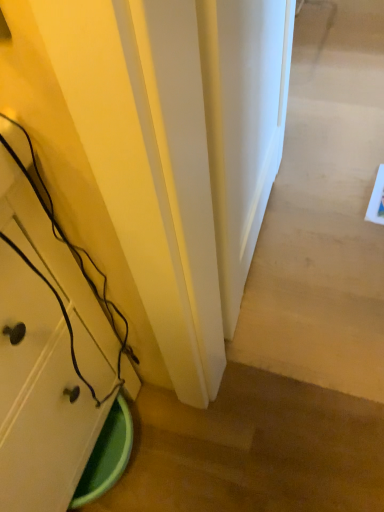
Locate an element on the screen. The image size is (384, 512). free spot in front of white smooth door at center is located at coordinates (296, 320).